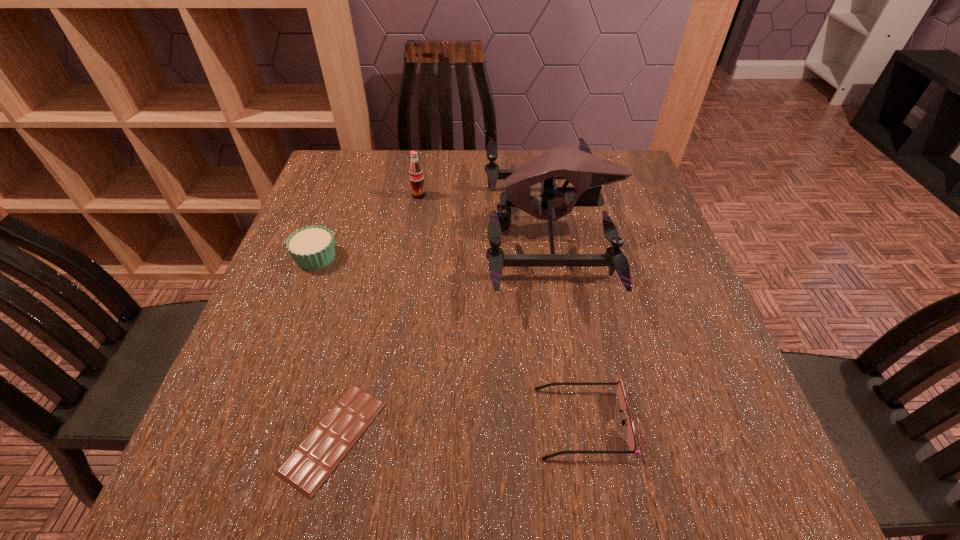
At what (x,y) coordinates should I click in order to perform the action: click on chocolate bar that is at the left edge. Please return your answer as a coordinate pair (x, y). The height and width of the screenshot is (540, 960). Looking at the image, I should click on (310, 464).

The image size is (960, 540). In order to click on object located at the right edge in this screenshot , I will do `click(586, 172)`.

In order to click on object that is at the near left corner in this screenshot , I will do `click(310, 464)`.

In order to click on object that is at the far right corner in this screenshot , I will do coord(586,172).

In order to click on free space at the far edge in this screenshot , I will do `click(382, 177)`.

Identify the location of vacant space at the near edge. Image resolution: width=960 pixels, height=540 pixels. (409, 453).

Locate an element on the screen. vacant space at the left edge is located at coordinates (293, 270).

Where is `vacant area at the right edge of the desktop`? This screenshot has height=540, width=960. vacant area at the right edge of the desktop is located at coordinates (687, 302).

The height and width of the screenshot is (540, 960). What are the coordinates of `vacant region at the far left corner of the desktop` in the screenshot? It's located at (346, 181).

Where is `vacant area that lies between the leftmost object and the soda`? This screenshot has width=960, height=540. vacant area that lies between the leftmost object and the soda is located at coordinates (368, 226).